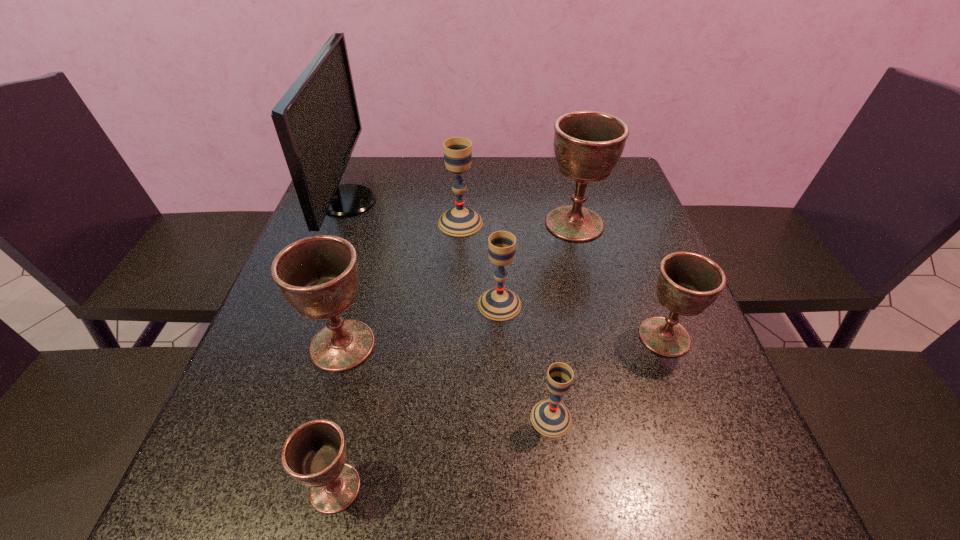
The width and height of the screenshot is (960, 540). I want to click on the nearest brown chalice, so click(314, 454).

Where is `the nearest chalice`? the nearest chalice is located at coordinates pyautogui.click(x=314, y=454).

I want to click on free space located 0.170m on the front-facing side of the computer monitor, so click(437, 201).

This screenshot has height=540, width=960. I want to click on vacant space located on the back of the second tallest object, so click(x=558, y=160).

Locate an element on the screen. The image size is (960, 540). vacant space located on the left of the farthest gray chalice is located at coordinates (389, 222).

The height and width of the screenshot is (540, 960). I want to click on blank space located 0.300m on the right of the third smallest brown chalice, so click(x=529, y=345).

This screenshot has width=960, height=540. I want to click on vacant region located 0.090m on the back of the second biggest gray chalice, so click(x=497, y=262).

In order to click on vacant space located 0.320m on the back of the second smallest brown chalice in this screenshot , I will do click(621, 224).

Locate an element on the screen. This screenshot has height=540, width=960. free location located 0.390m on the left of the second nearest object is located at coordinates (304, 418).

Find the location of `vacant position located 0.370m on the right of the nearest chalice`. vacant position located 0.370m on the right of the nearest chalice is located at coordinates (603, 488).